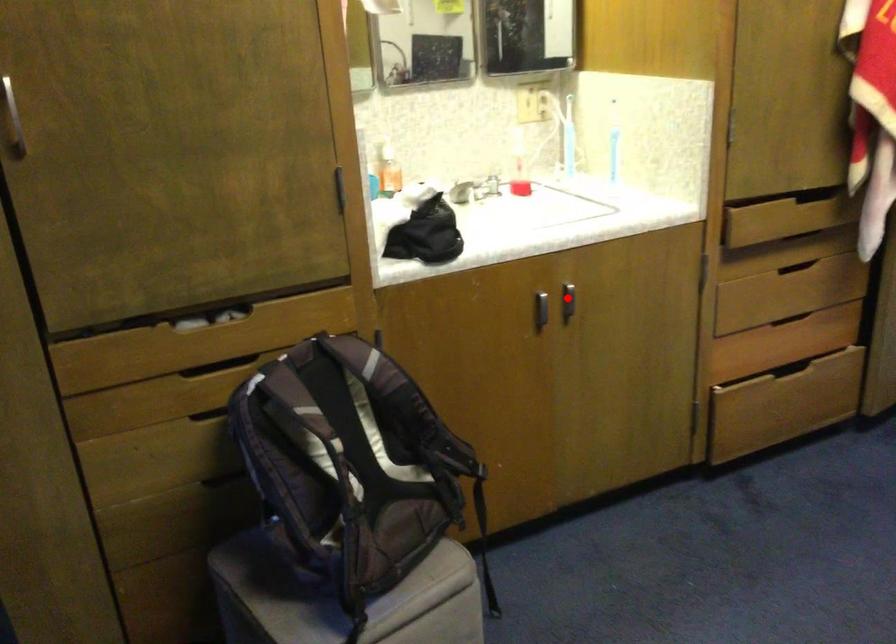
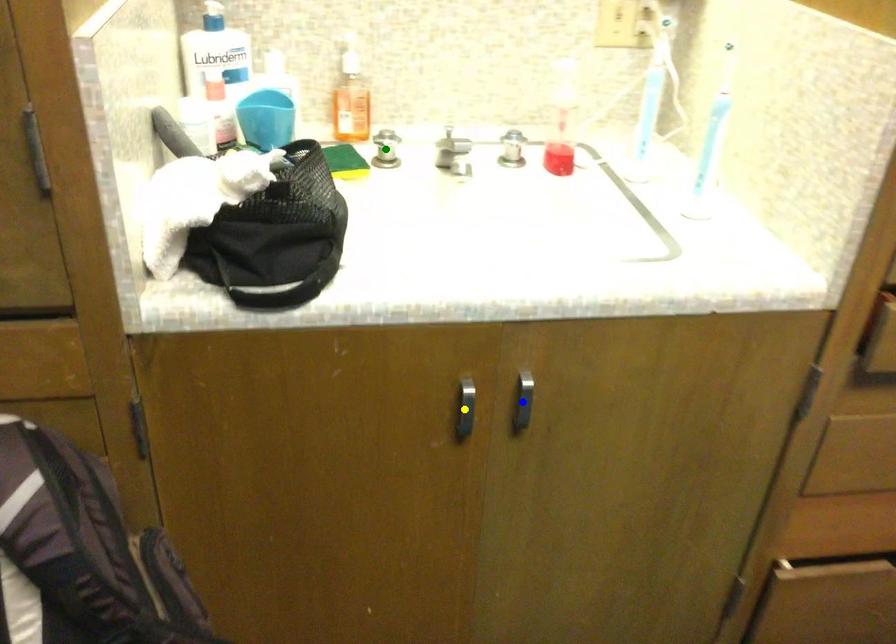
Question: I am providing you with two images of the same scene from different viewpoints. A red point is marked on the first image. You are given multiple points on the second image. Can you choose the point in image 2 that corresponds to the point in image 1?

Choices:
 (A) yellow point
 (B) green point
 (C) blue point

Answer: (C)